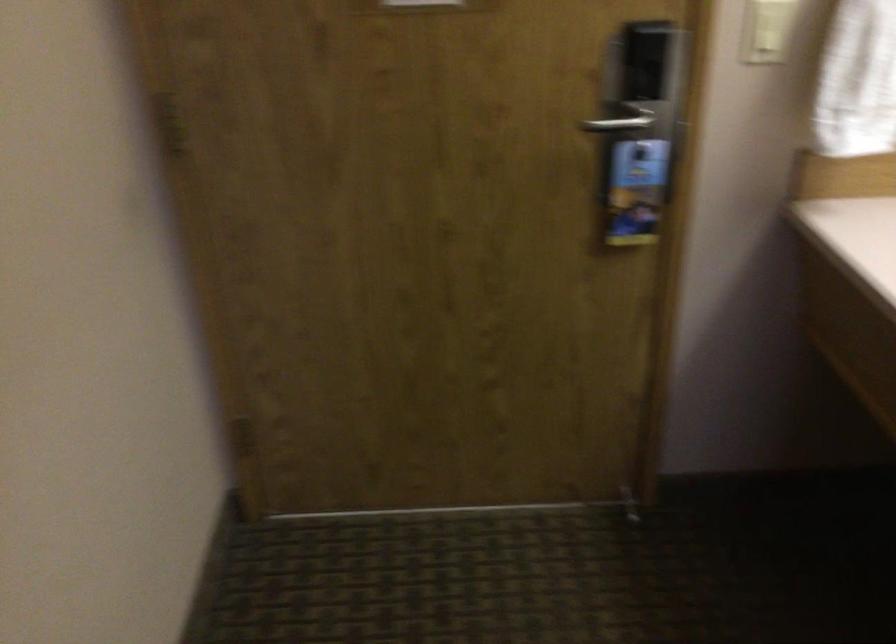
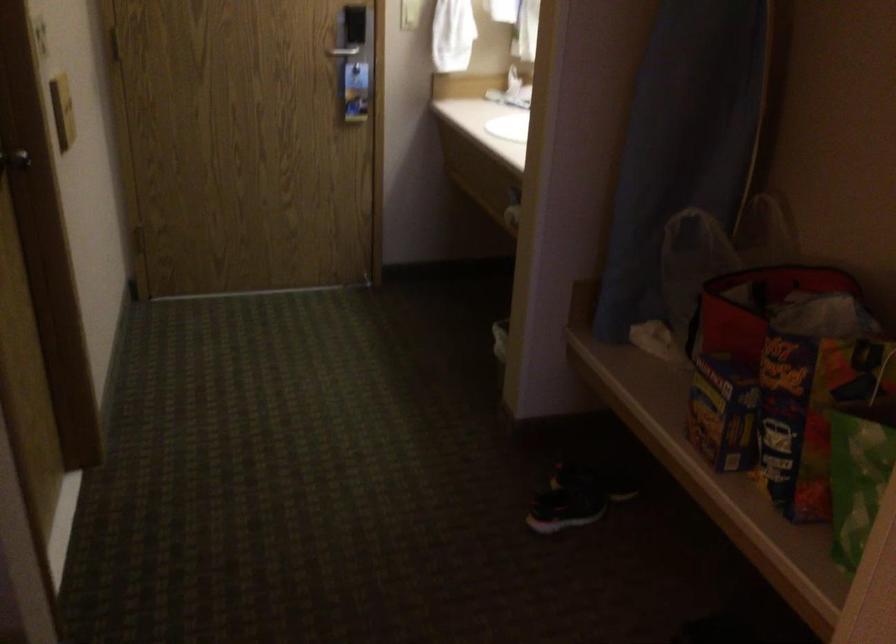
Question: In a continuous first-person perspective shot, in which direction is the camera moving?

Choices:
 (A) Left
 (B) Right
 (C) Forward
 (D) Backward

Answer: (D)